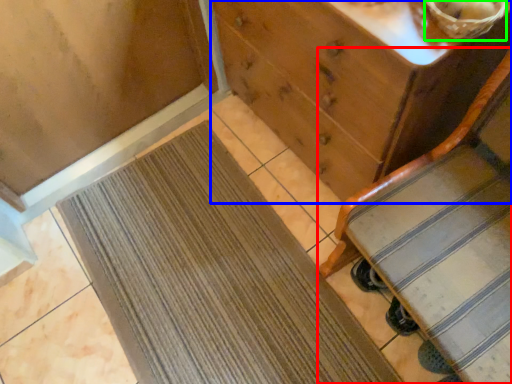
Question: Which object is the farthest from furniture (highlighted by a red box)? Choose among these: chest of drawers (highlighted by a blue box) or basket (highlighted by a green box).

Choices:
 (A) chest of drawers
 (B) basket

Answer: (B)